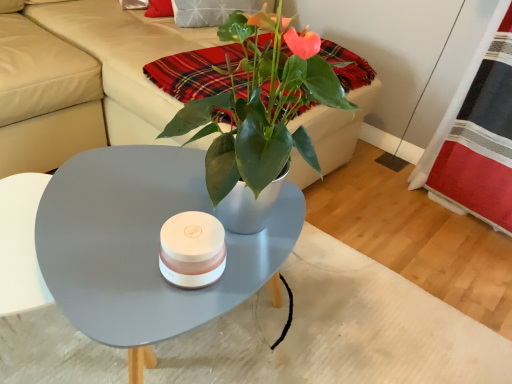
The width and height of the screenshot is (512, 384). In order to click on free space above matte gray coffee table at center (from a real-world perspective) in this screenshot , I will do `click(136, 212)`.